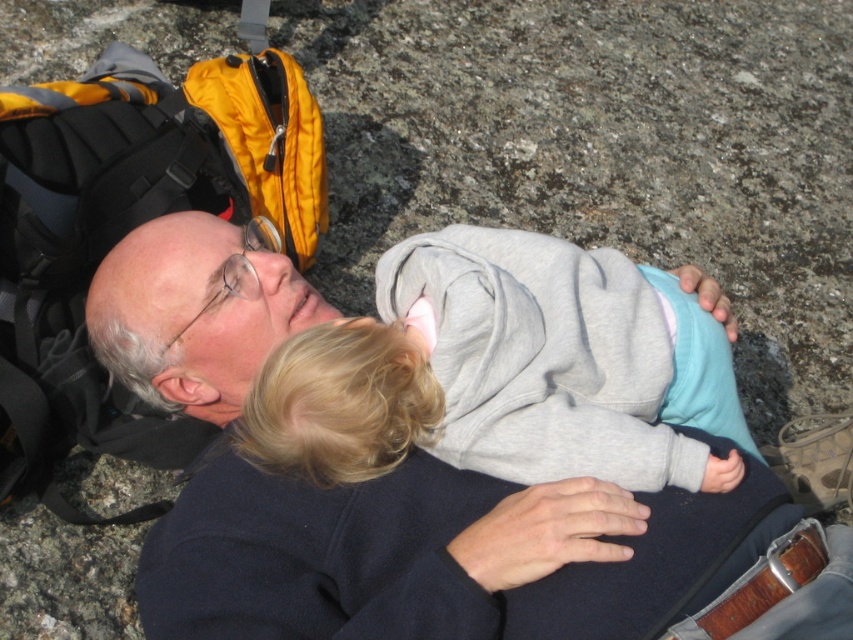
Does dark blue sweater at center appear under gray fleece jacket at center?

Yes, dark blue sweater at center is below gray fleece jacket at center.

Which is in front, point (599, 486) or point (718, 369)?

Positioned in front is point (599, 486).

Find the location of `dark blue sweater at center`. dark blue sweater at center is located at coordinates (440, 554).